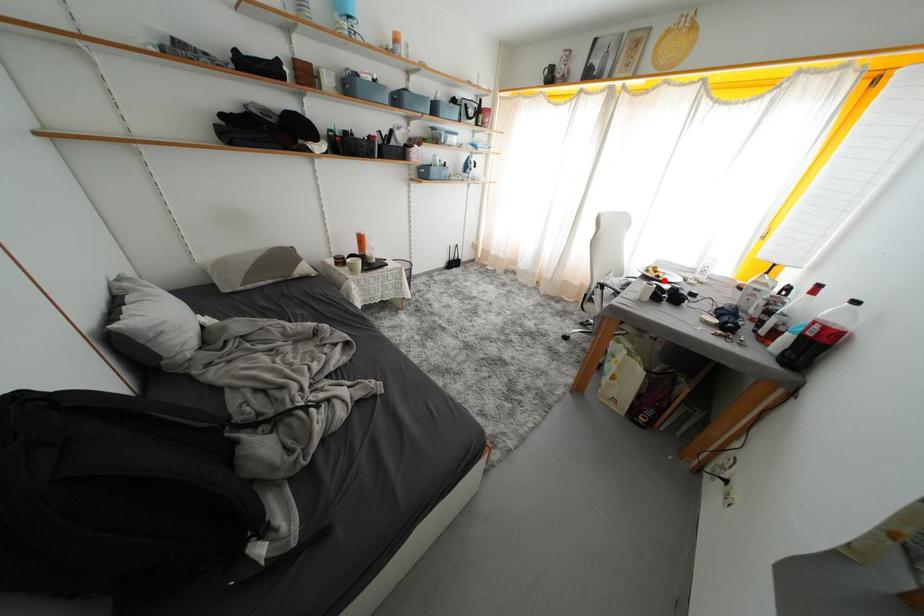
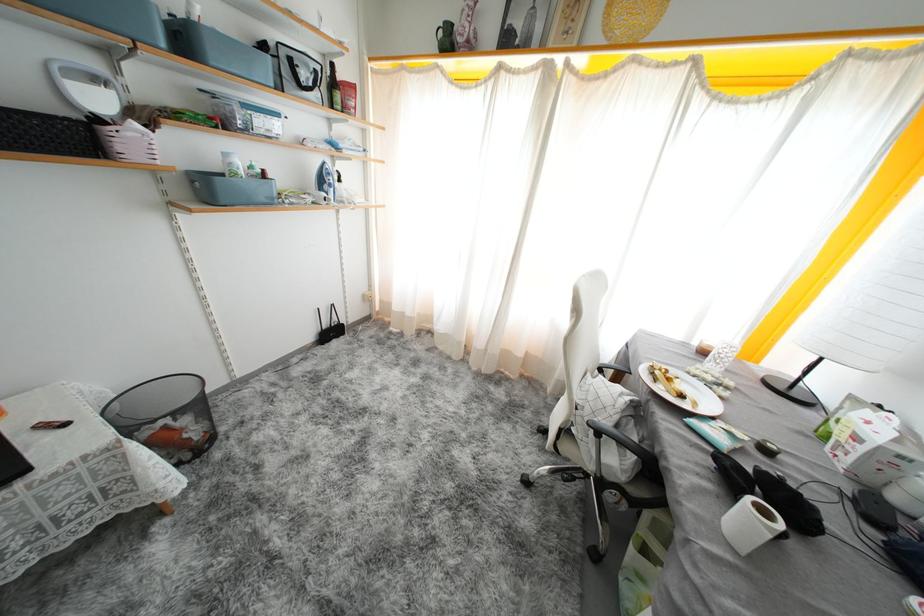
Question: I am providing you with two images of the same scene from different viewpoints. Image1 has a red point marked. In image2, the corresponding 3D location appears at what relative position? Reply with the corresponding letter.

Choices:
 (A) Closer
 (B) Farther

Answer: (B)